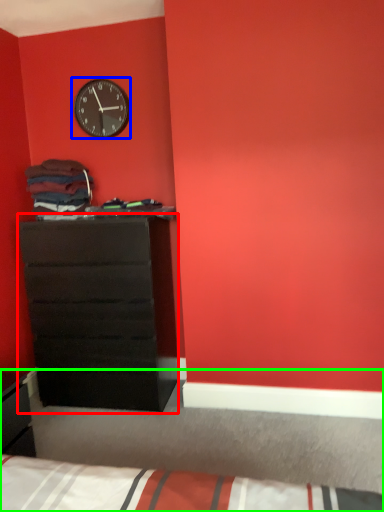
Question: Which object is positioned closest to chest of drawers (highlighted by a red box)? Select from wall clock (highlighted by a blue box) and bed (highlighted by a green box).

Choices:
 (A) wall clock
 (B) bed

Answer: (A)